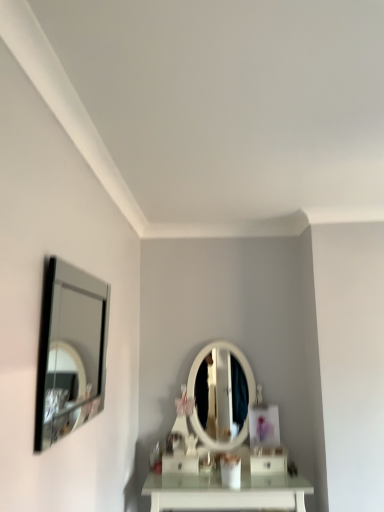
Question: Is white glossy drawer at center, arranged as the first drawer when viewed from the left, bigger or smaller than silver-framed mirror at left?

Choices:
 (A) small
 (B) big

Answer: (A)

Question: Based on their positions, is white glossy drawer at center, arranged as the 2th drawer when viewed from the right, located to the left or right of silver-framed mirror at left?

Choices:
 (A) left
 (B) right

Answer: (B)

Question: Based on their relative distances, which object is farther from the white glossy drawer at center, arranged as the first drawer when viewed from the left?

Choices:
 (A) white glossy drawer at lower center, which ranks as the second drawer in left-to-right order
 (B) silver-framed mirror at left

Answer: (B)

Question: Which is nearer to the white glossy drawer at lower center, acting as the 1th drawer starting from the right?

Choices:
 (A) silver-framed mirror at left
 (B) white glossy drawer at center, arranged as the first drawer when viewed from the left

Answer: (B)